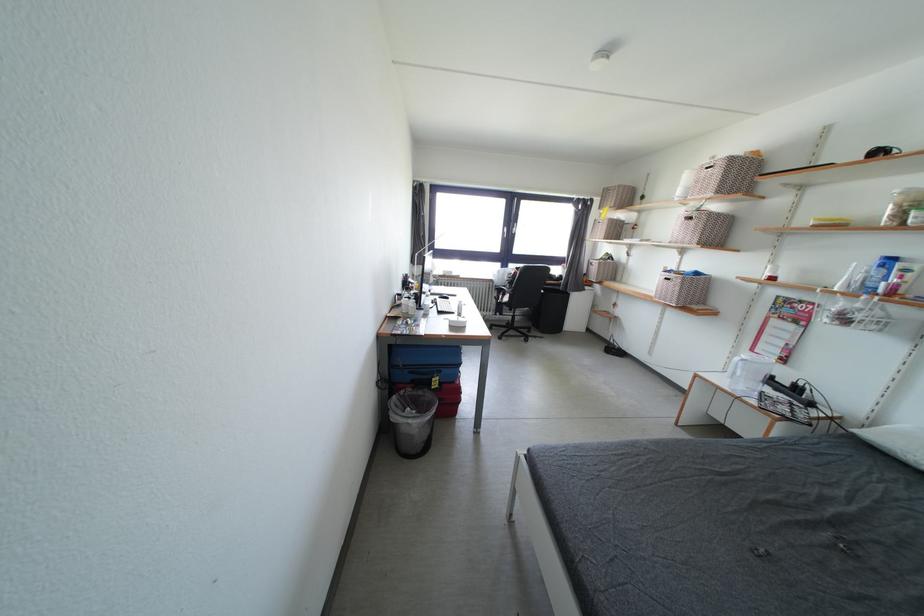
The location [748,374] corresponds to which object?

It refers to a clear plastic container.